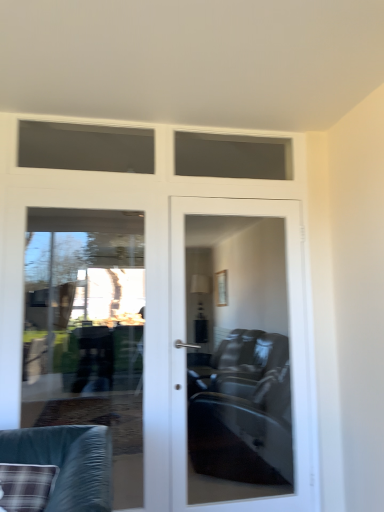
Question: Is clear glass door at left beside plaid fabric cushion at lower left?

Choices:
 (A) no
 (B) yes

Answer: (A)

Question: Is clear glass door at left turned away from plaid fabric cushion at lower left?

Choices:
 (A) yes
 (B) no

Answer: (A)

Question: From a real-world perspective, is clear glass door at left below plaid fabric cushion at lower left?

Choices:
 (A) no
 (B) yes

Answer: (A)

Question: Can you confirm if clear glass door at left is thinner than plaid fabric cushion at lower left?

Choices:
 (A) no
 (B) yes

Answer: (B)

Question: Does clear glass door at left appear on the right side of plaid fabric cushion at lower left?

Choices:
 (A) no
 (B) yes

Answer: (B)

Question: Is clear glass door at left bigger or smaller than matte glass door at center?

Choices:
 (A) small
 (B) big

Answer: (A)

Question: Considering the positions of clear glass door at left and matte glass door at center in the image, is clear glass door at left taller or shorter than matte glass door at center?

Choices:
 (A) short
 (B) tall

Answer: (A)

Question: In terms of width, does clear glass door at left look wider or thinner when compared to matte glass door at center?

Choices:
 (A) thin
 (B) wide

Answer: (A)

Question: From the image's perspective, is clear glass door at left positioned above or below matte glass door at center?

Choices:
 (A) above
 (B) below

Answer: (A)

Question: In the image, is matte glass door at center on the left side or the right side of clear glass door at left?

Choices:
 (A) right
 (B) left

Answer: (A)

Question: Considering the positions of point (253, 471) and point (41, 358), is point (253, 471) closer or farther from the camera than point (41, 358)?

Choices:
 (A) farther
 (B) closer

Answer: (B)

Question: In terms of width, does matte glass door at center look wider or thinner when compared to clear glass door at left?

Choices:
 (A) wide
 (B) thin

Answer: (A)

Question: In terms of height, does matte glass door at center look taller or shorter compared to clear glass door at left?

Choices:
 (A) tall
 (B) short

Answer: (A)

Question: Visually, is matte glass door at center positioned to the left or to the right of plaid fabric cushion at lower left?

Choices:
 (A) left
 (B) right

Answer: (B)

Question: From a real-world perspective, is matte glass door at center positioned above or below plaid fabric cushion at lower left?

Choices:
 (A) above
 (B) below

Answer: (A)